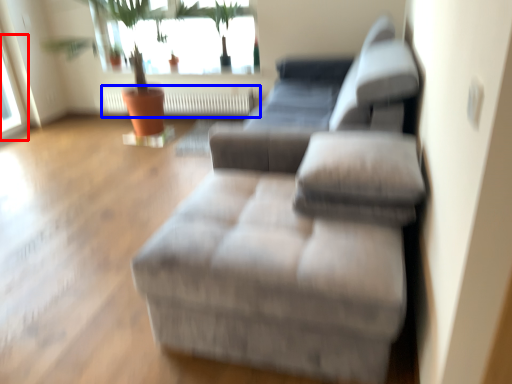
Question: Which object is further to the camera taking this photo, window (highlighted by a red box) or radiator (highlighted by a blue box)?

Choices:
 (A) window
 (B) radiator

Answer: (B)